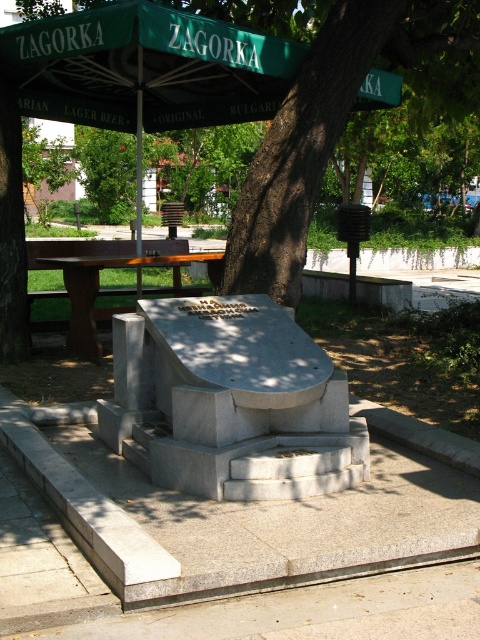
Question: Based on their relative distances, which object is farther from the green leafy tree at center?

Choices:
 (A) green fabric umbrella at upper center
 (B) brown wooden picnic table at left
 (C) gray granite monument at center

Answer: (C)

Question: Does gray granite monument at center have a greater width compared to brown wooden picnic table at left?

Choices:
 (A) no
 (B) yes

Answer: (B)

Question: Which point is closer to the camera?

Choices:
 (A) (305, 113)
 (B) (128, 84)
 (C) (19, 435)
 (D) (188, 262)

Answer: (C)

Question: Estimate the real-world distances between objects in this image. Which object is closer to the green fabric umbrella at upper center?

Choices:
 (A) brown wooden picnic table at left
 (B) gray granite monument at center

Answer: (A)

Question: Does gray granite monument at center appear on the right side of green leafy tree at center?

Choices:
 (A) no
 (B) yes

Answer: (A)

Question: Does green leafy tree at center appear under brown wooden picnic table at left?

Choices:
 (A) no
 (B) yes

Answer: (A)